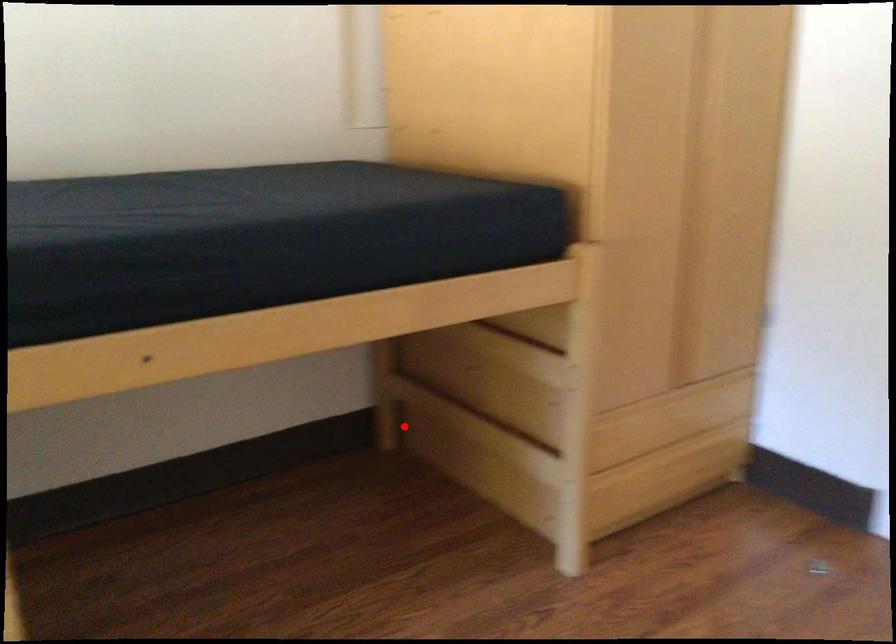
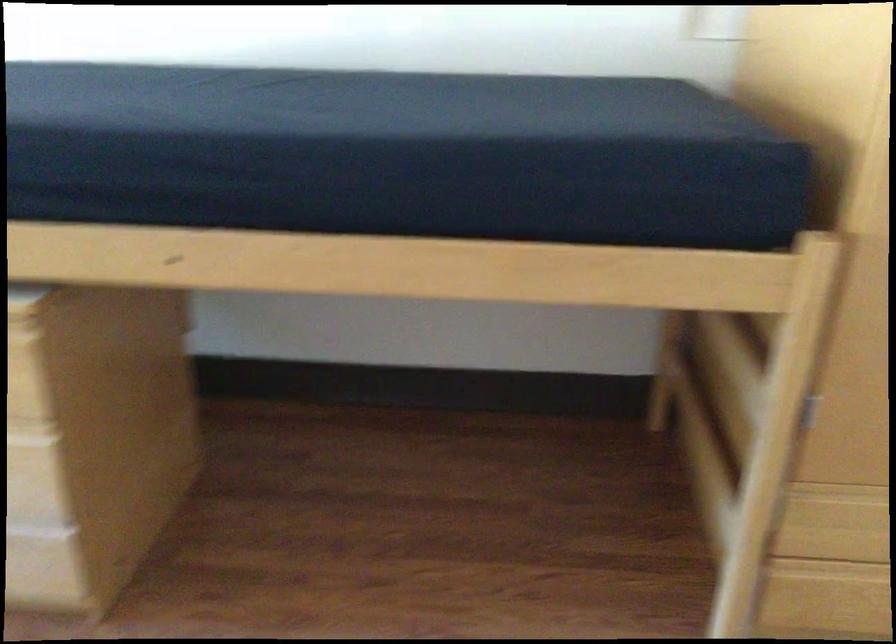
In the second image, find the point that corresponds to the highlighted location in the first image.

(673, 408)